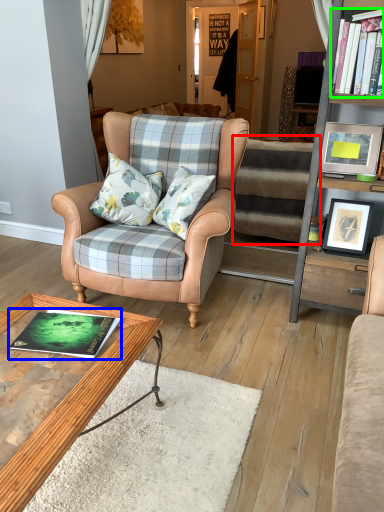
Question: Which object is positioned farthest from stairwell (highlighted by a red box)? Select from book (highlighted by a blue box) and book (highlighted by a green box).

Choices:
 (A) book
 (B) book

Answer: (A)